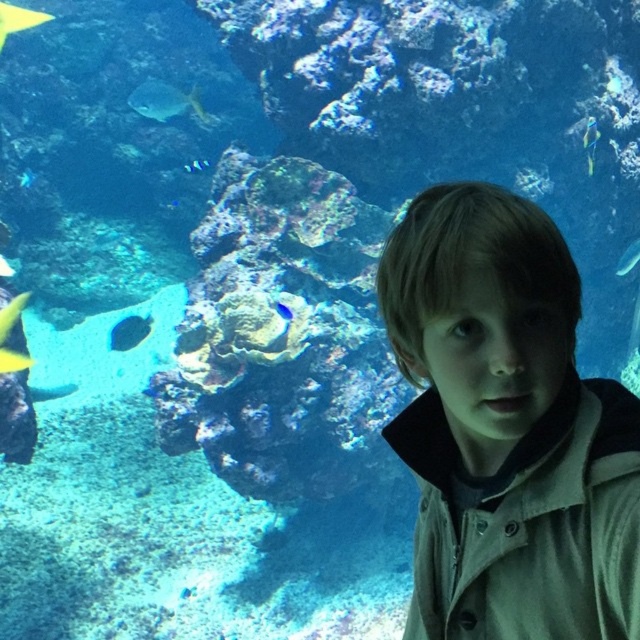
You are an underwater photographer aiming to capture both the yellow matte fish at left and the blue glossy fish at center in a single frame. Based on their positions, which fish should you adjust your camera to focus on first to ensure both are in the shot?

The yellow matte fish at left should be focused on first since it is positioned to the left of the blue glossy fish at center, allowing the photographer to frame both by centering the blue glossy fish and including the yellow matte fish on the left side of the frame.

You are a diver who wants to reach the point closer to you. Which point should you swim towards, point (113,336) or point (593,129)?

You should swim towards point (113,336) because it is closer to you than point (593,129).

You are a marine biologist observing the aquarium scene. You notice two fish species in the image. Which fish is positioned to the left of the other? The options are the blue iridescent fish at upper right and the shiny blue fish at center.

The blue iridescent fish at upper right is positioned to the left of the shiny blue fish at center.